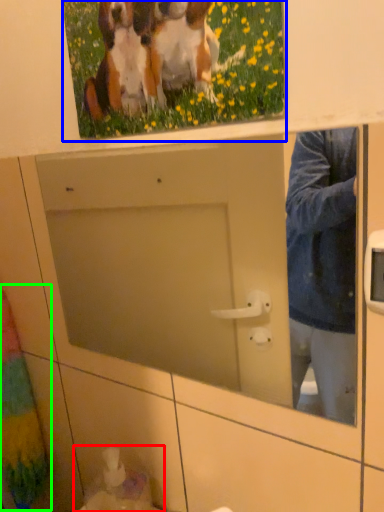
Question: Which object is the closest to the sink (highlighted by a red box)? Choose among these: picture frame (highlighted by a blue box) or curtain (highlighted by a green box).

Choices:
 (A) picture frame
 (B) curtain

Answer: (B)